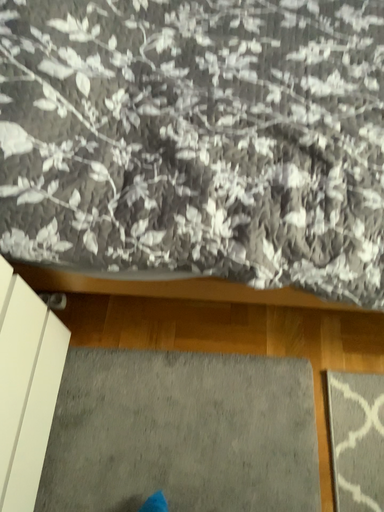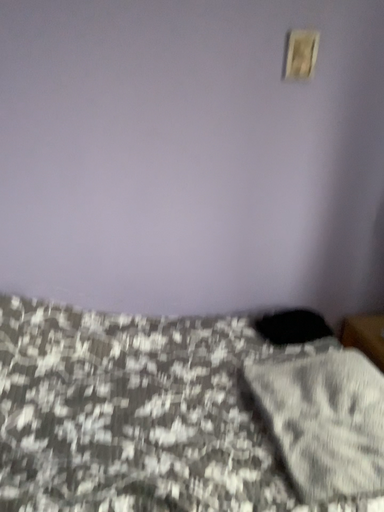
Question: Which way did the camera rotate in the video?

Choices:
 (A) rotated right
 (B) rotated left

Answer: (A)